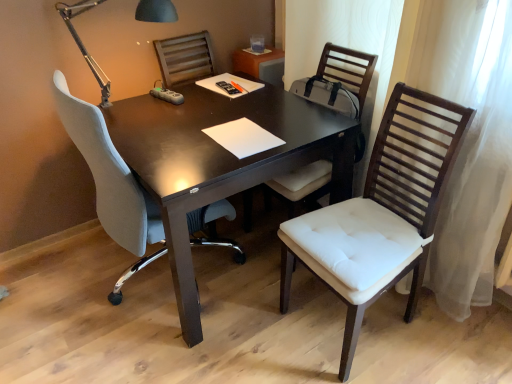
Find the location of a particular element. vacant area to the left of white fabric chair at left, the 3th chair when ordered from right to left is located at coordinates (57, 288).